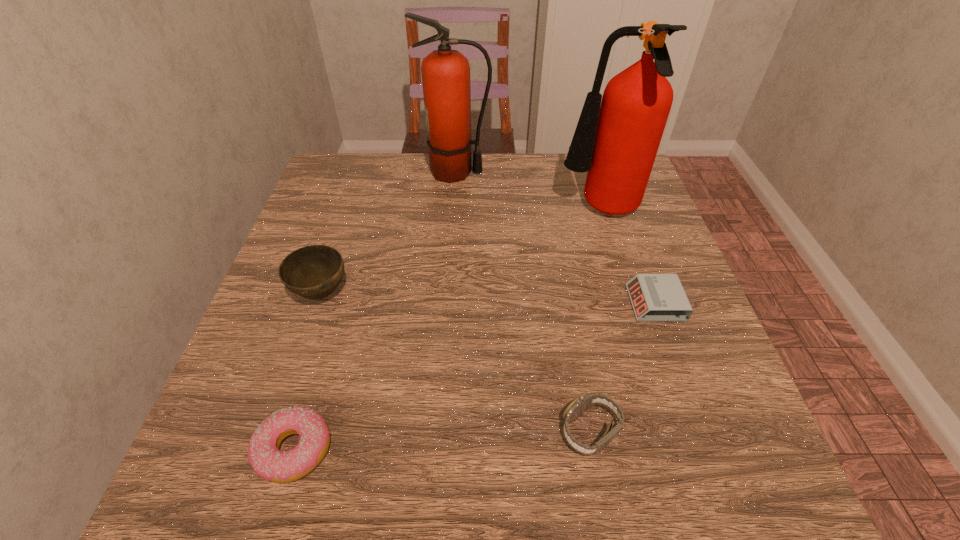
Where is `unoccupied position between the third shortest object and the fourth object from right to left`? unoccupied position between the third shortest object and the fourth object from right to left is located at coordinates click(x=523, y=302).

At what (x,y) coordinates should I click in order to perform the action: click on object that is the closest to the farthest object. Please return your answer as a coordinate pair (x, y). The image size is (960, 540). Looking at the image, I should click on (616, 140).

Locate which object ranks second in proximity to the farthest object. Please provide its 2D coordinates. Your answer should be formatted as a tuple, i.e. [(x, y)], where the tuple contains the x and y coordinates of a point satisfying the conditions above.

[(314, 272)]

You are a GUI agent. You are given a task and a screenshot of the screen. Output one action in this format:
    pyautogui.click(x=<x>, y=<y>)
    Task: Click on the vacant point that satisfies the following two spatial constraints: 1. on the front side of the bowl; 2. on the left side of the shortest object
    The height and width of the screenshot is (540, 960).
    Given the screenshot: What is the action you would take?
    pyautogui.click(x=319, y=303)

Locate an element on the screen. This screenshot has width=960, height=540. vacant space that satisfies the following two spatial constraints: 1. on the nozzle of the farthest object; 2. on the left side of the shortest object is located at coordinates (446, 303).